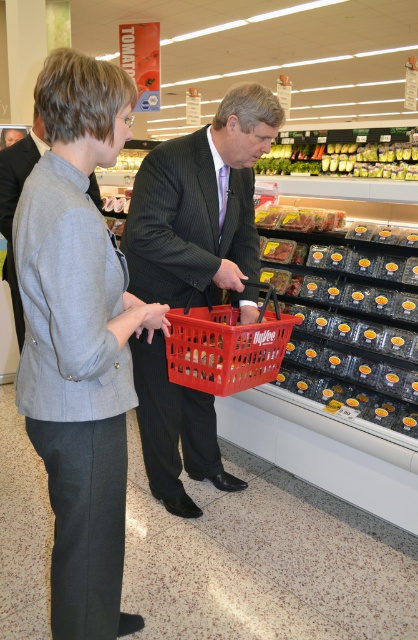
Question: Is gray woolen blazer at left to the right of gray wool suit at center from the viewer's perspective?

Choices:
 (A) yes
 (B) no

Answer: (A)

Question: Which of these objects is positioned closest to the gray woolen blazer at left?

Choices:
 (A) green leafy vegetables at upper center
 (B) gray wool suit at center

Answer: (B)

Question: Is matte black suit at center above translucent plastic basket at center?

Choices:
 (A) yes
 (B) no

Answer: (B)

Question: Which of the following is the farthest from the observer?

Choices:
 (A) click(x=150, y=317)
 (B) click(x=119, y=515)
 (C) click(x=267, y=168)

Answer: (C)

Question: Which point is farther from the camera taking this photo?

Choices:
 (A) (27, 348)
 (B) (338, 157)
 (C) (221, 392)
 (D) (191, 419)

Answer: (B)

Question: Can you confirm if dark gray pinstripe suit at center is positioned above gray wool suit at center?

Choices:
 (A) yes
 (B) no

Answer: (B)